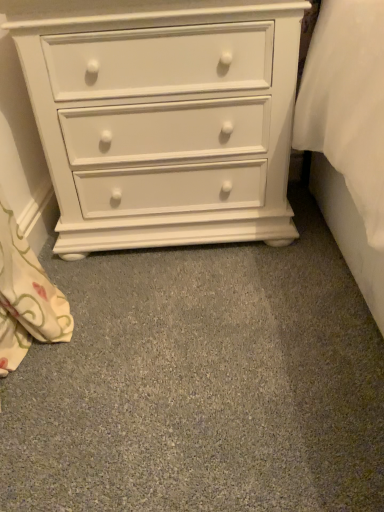
The height and width of the screenshot is (512, 384). In order to click on white matte chest of drawers at center in this screenshot , I will do `click(163, 118)`.

Describe the element at coordinates (163, 118) in the screenshot. I see `white matte chest of drawers at center` at that location.

Find the location of a particular element. white matte chest of drawers at center is located at coordinates pyautogui.click(x=163, y=118).